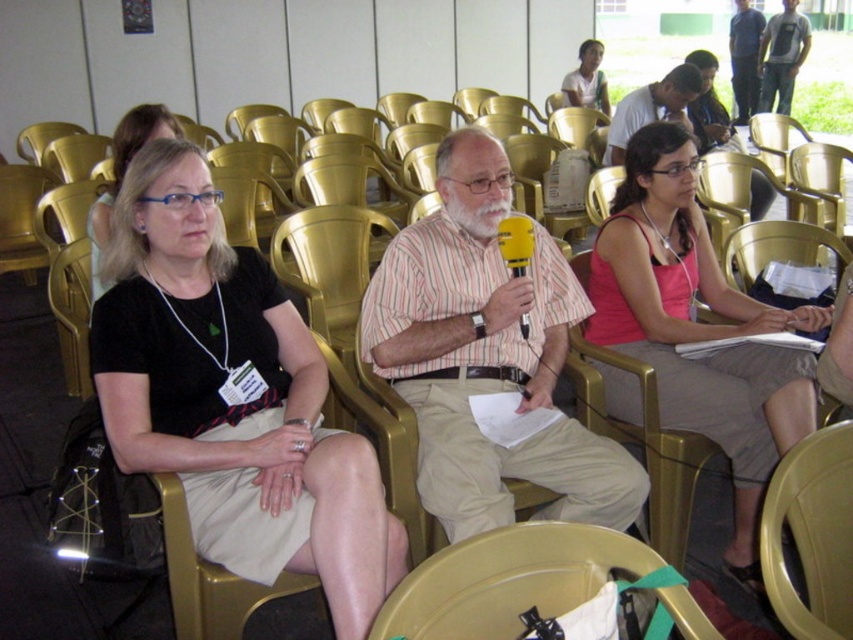
This screenshot has width=853, height=640. Find the location of `black fabric skirt at center`. black fabric skirt at center is located at coordinates (231, 396).

Who is positioned more to the left, black fabric skirt at center or matte white shirt at upper center?

From the viewer's perspective, black fabric skirt at center appears more on the left side.

Which is behind, point (148, 301) or point (599, 96)?

The point (599, 96) is behind.

Locate an element on the screen. This screenshot has width=853, height=640. black fabric skirt at center is located at coordinates (x=231, y=396).

Can you confirm if black fabric skirt at center is thinner than metallic gold chair at lower center?

In fact, black fabric skirt at center might be wider than metallic gold chair at lower center.

Can you confirm if black fabric skirt at center is positioned below metallic gold chair at lower center?

Incorrect, black fabric skirt at center is not positioned below metallic gold chair at lower center.

This screenshot has height=640, width=853. I want to click on black fabric skirt at center, so click(231, 396).

Which is more to the left, pink fabric tank top at center or matte white shirt at upper center?

Positioned to the left is pink fabric tank top at center.

Between point (685, 236) and point (604, 100), which one is positioned behind?

Point (604, 100)

You are a GUI agent. You are given a task and a screenshot of the screen. Output one action in this format:
    pyautogui.click(x=<x>, y=<y>)
    Task: Click on the pink fabric tank top at center
    The width and height of the screenshot is (853, 640).
    Given the screenshot: What is the action you would take?
    [x=698, y=328]